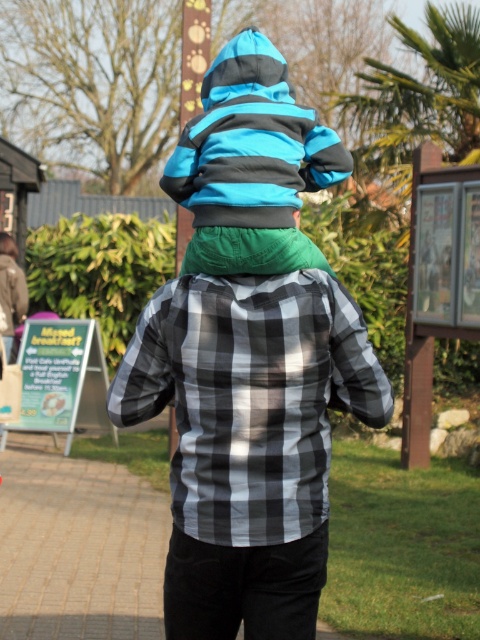
You are standing at the edge of the paved area and want to hand a small item to the adult wearing the black checkered shirt at center. If you can throw the item 5 meters, will you be able to reach them?

The distance between you and the adult wearing the black checkered shirt at center is 5.54 meters, so you cannot reach them with a 5 meter throw.

You are a photographer trying to capture a photo of the checkered fabric shirt at center and the black checkered shirt at center. Which one is covering the other?

The checkered fabric shirt at center is positioned over the black checkered shirt at center, so it is covering it.